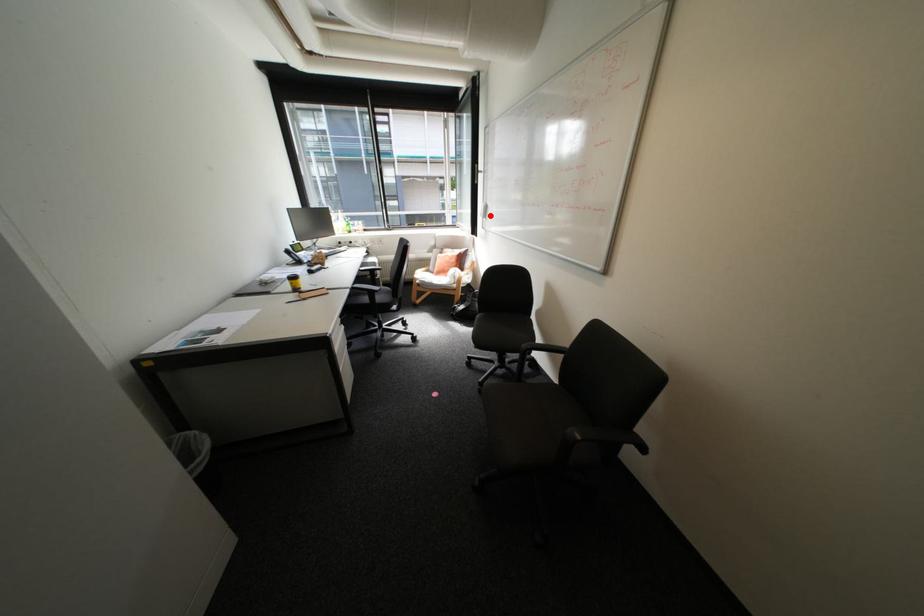
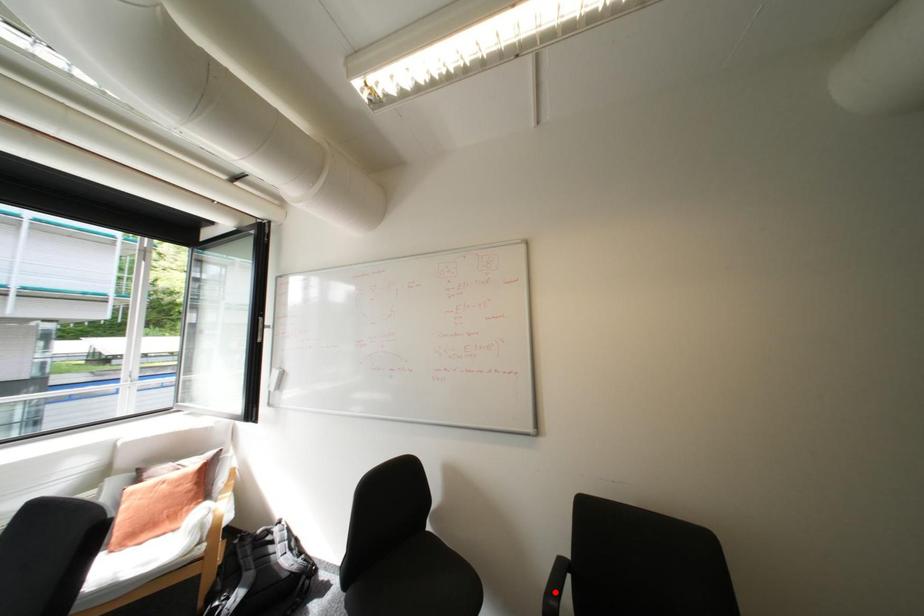
I am providing you with two images of the same scene from different viewpoints. A red point is marked on the first image and another point is marked on the second image. Are the points marked in image1 and image2 representing the same 3D position?

No